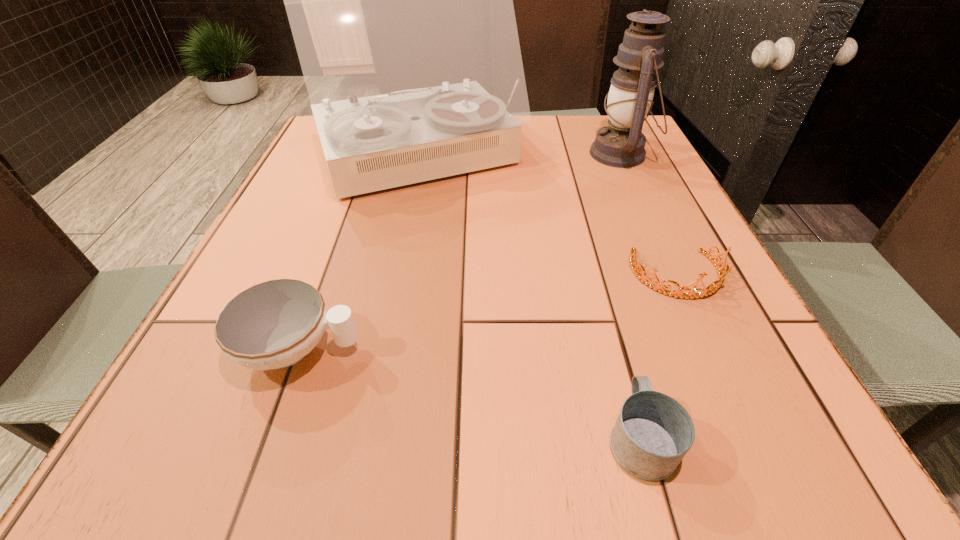
Locate an element on the screen. The width and height of the screenshot is (960, 540). object that is at the far left corner is located at coordinates (400, 0).

Locate an element on the screen. object that is at the far right corner is located at coordinates (621, 144).

In order to click on vacant space at the far edge of the desktop in this screenshot , I will do `click(542, 126)`.

The width and height of the screenshot is (960, 540). I want to click on free region at the near edge of the desktop, so click(280, 468).

Find the location of a particular element. vacant space at the right edge of the desktop is located at coordinates (743, 384).

Image resolution: width=960 pixels, height=540 pixels. In order to click on free region at the near right corner of the desktop in this screenshot , I will do `click(808, 482)`.

Where is `free space between the second tallest object and the chinaware`? The width and height of the screenshot is (960, 540). free space between the second tallest object and the chinaware is located at coordinates (460, 252).

Identify the location of free space between the third farthest object and the mug. (659, 356).

Identify the location of vacant space that is in between the mug and the second tallest object. (631, 295).

You are a GUI agent. You are given a task and a screenshot of the screen. Output one action in this format:
    pyautogui.click(x=<x>, y=<y>)
    Task: Click on the vacant region between the oil lamp and the chinaware
    
    Given the screenshot: What is the action you would take?
    pyautogui.click(x=460, y=252)